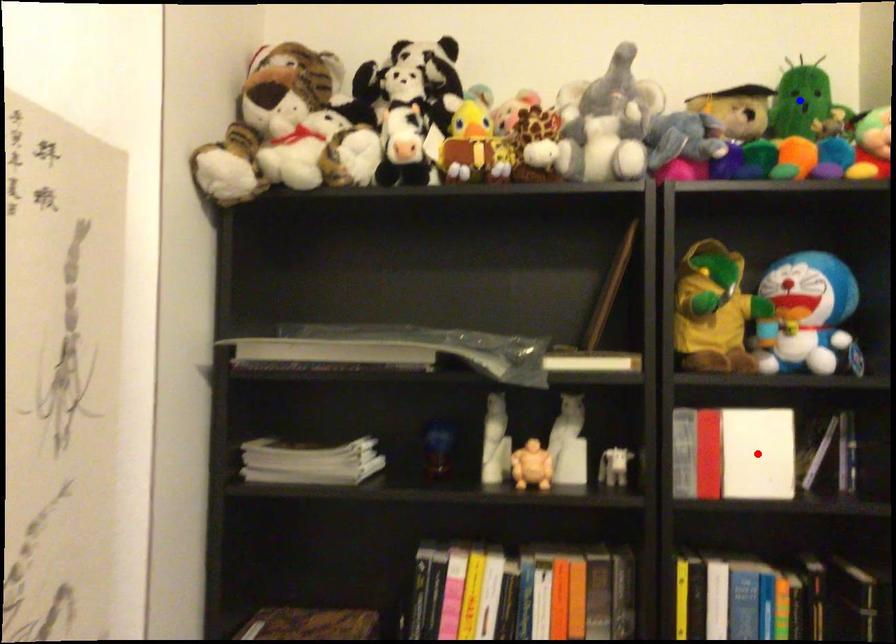
Question: Two points are marked on the image. Which point is closer to the camera?

Choices:
 (A) Blue point is closer.
 (B) Red point is closer.

Answer: (B)